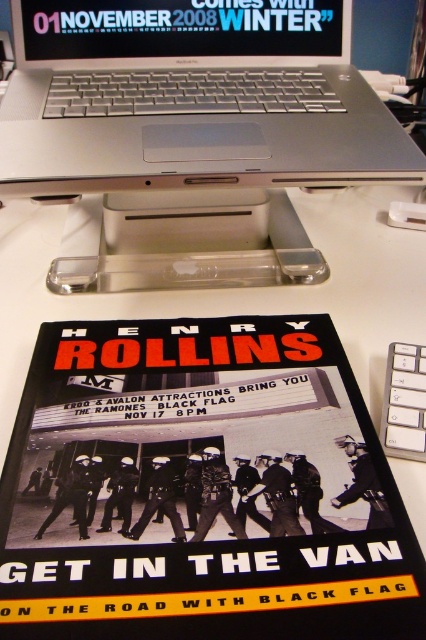
Question: Estimate the real-world distances between objects in this image. Which object is farther from the silver metallic laptop at upper center?

Choices:
 (A) black paper poster at lower center
 (B) matte plastic laptop at upper center

Answer: (A)

Question: Which point is farther from the camera taking this photo?

Choices:
 (A) (284, 29)
 (B) (51, 67)
 (C) (124, 573)

Answer: (A)

Question: Is black paper poster at lower center closer to the viewer compared to silver metallic laptop at upper center?

Choices:
 (A) yes
 (B) no

Answer: (A)

Question: Which object appears closest to the camera in this image?

Choices:
 (A) black paper poster at lower center
 (B) matte plastic laptop at upper center

Answer: (A)

Question: Is black paper poster at lower center to the left of matte plastic laptop at upper center from the viewer's perspective?

Choices:
 (A) no
 (B) yes

Answer: (A)

Question: Can you confirm if black paper poster at lower center is positioned to the right of silver metallic laptop at upper center?

Choices:
 (A) yes
 (B) no

Answer: (A)